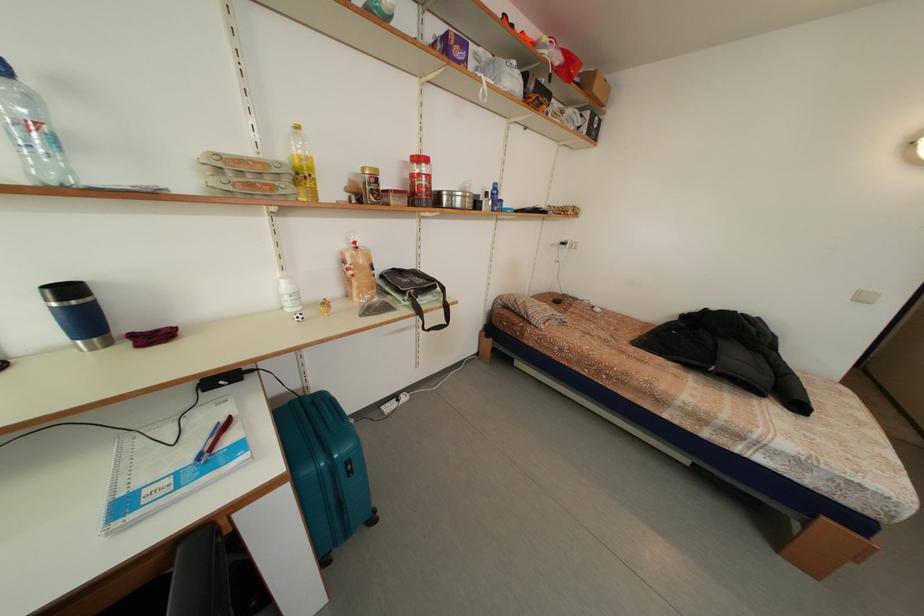
This screenshot has width=924, height=616. Identify the location of white bag handle. (496, 71).